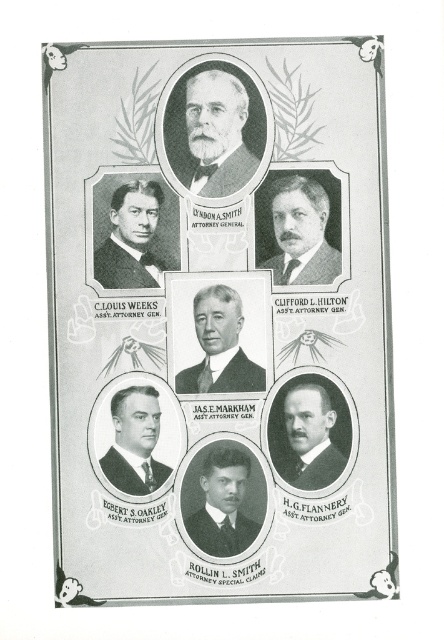
Question: Does black paper at upper center appear on the left side of smooth gray suit at center?

Choices:
 (A) no
 (B) yes

Answer: (A)

Question: Which of these objects is positioned closest to the matte black suit at center?

Choices:
 (A) smooth black suit at center
 (B) dark brown suit at center
 (C) black paper at upper center
 (D) black suit at left

Answer: (B)

Question: Is smooth brown suit at center wider than smooth black suit at center?

Choices:
 (A) yes
 (B) no

Answer: (A)

Question: Which of the following is the closest to the observer?

Choices:
 (A) smooth black suit at center
 (B) smooth gray suit at center
 (C) matte black suit at center

Answer: (B)

Question: Can you confirm if black paper at upper center is positioned to the right of black suit at left?

Choices:
 (A) no
 (B) yes

Answer: (B)

Question: Among these objects, which one is nearest to the camera?

Choices:
 (A) smooth black suit at center
 (B) black paper at upper center

Answer: (B)